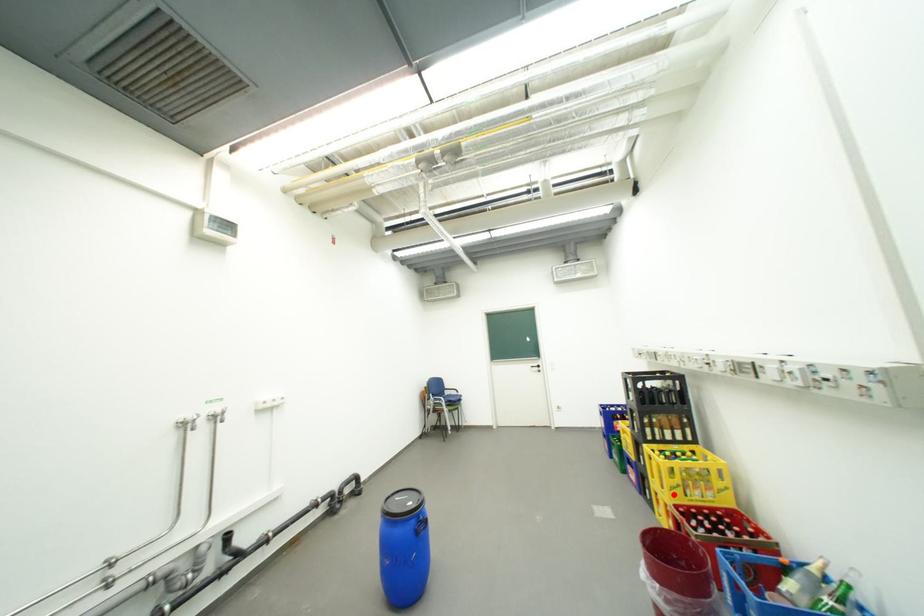
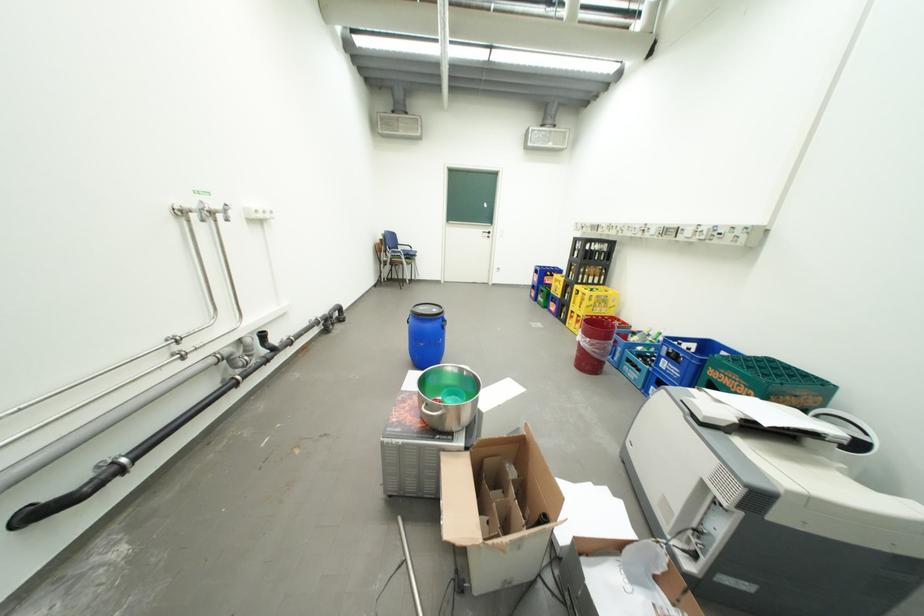
Find the pixel in the second image that matches the highlighted location in the first image.

(590, 312)